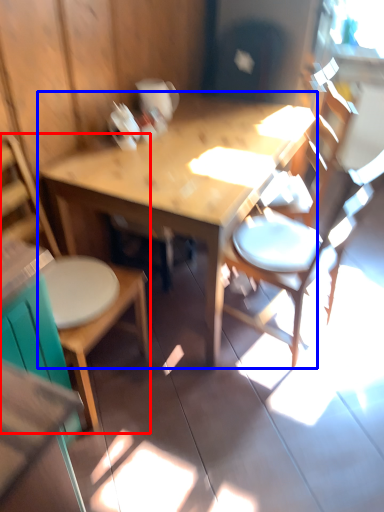
Question: Which object is further to the camera taking this photo, chair (highlighted by a red box) or table (highlighted by a blue box)?

Choices:
 (A) chair
 (B) table

Answer: (B)